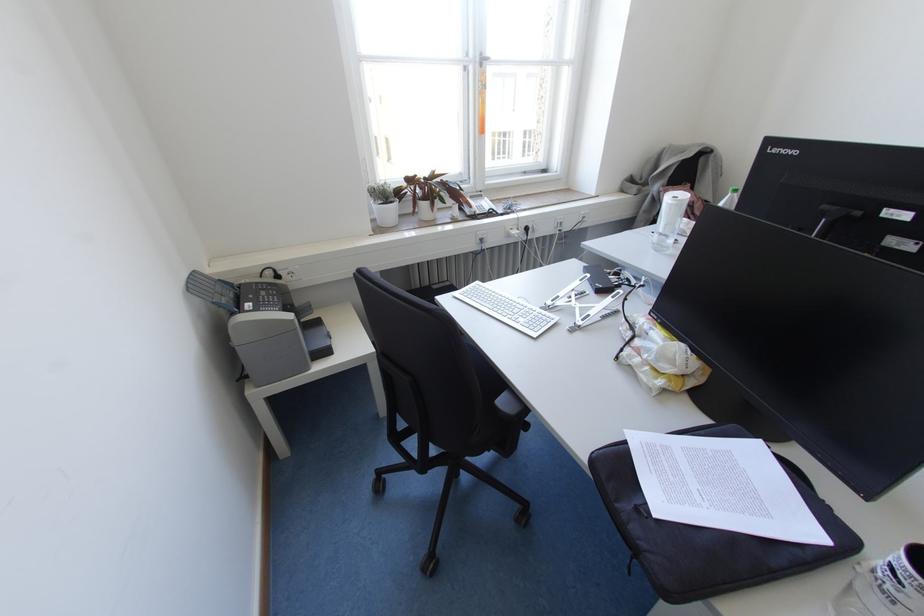
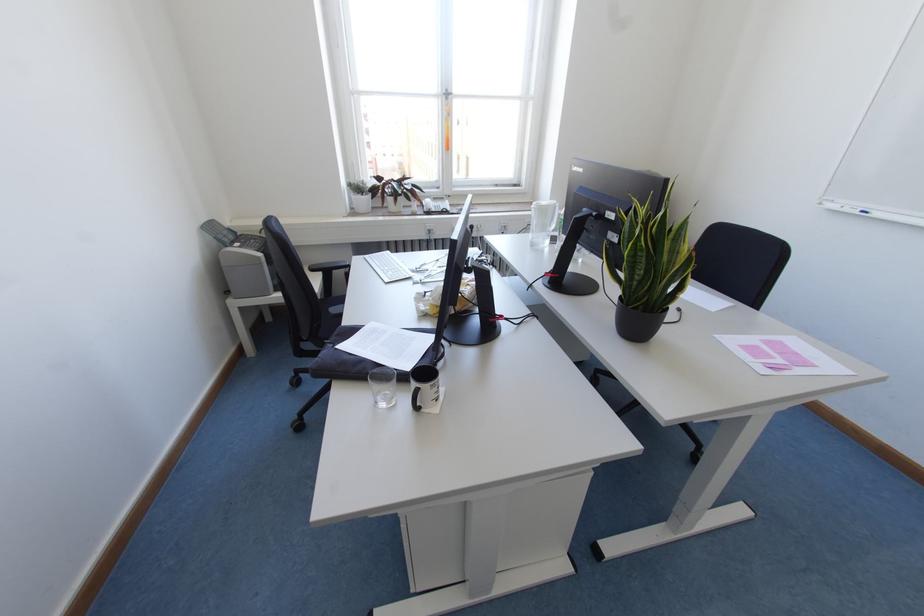
Based on the photo, the images are taken continuously from a first-person perspective. In which direction are you moving?

The cameraman moved toward right, backward.